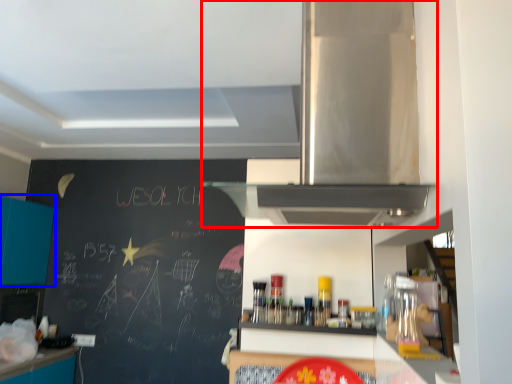
Question: Which object appears farthest to the camera in this image, home appliance (highlighted by a red box) or cabinetry (highlighted by a blue box)?

Choices:
 (A) home appliance
 (B) cabinetry

Answer: (B)